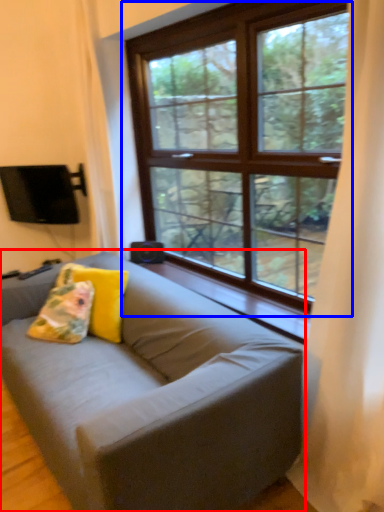
Question: Which object appears farthest to the camera in this image, studio couch (highlighted by a red box) or window (highlighted by a blue box)?

Choices:
 (A) studio couch
 (B) window

Answer: (B)